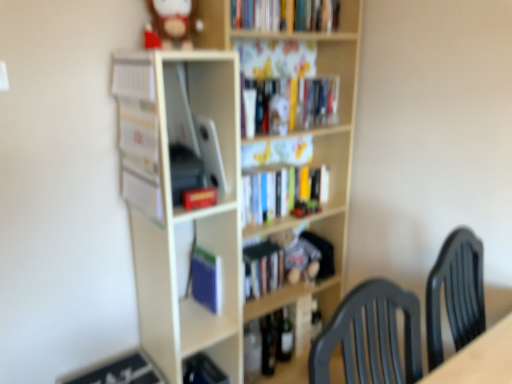
Question: From the image's perspective, does white paper at left, the third book from the top, appear lower than white matte bookshelf at center, marked as the second shelf in a right-to-left arrangement?

Choices:
 (A) yes
 (B) no

Answer: (B)

Question: Is white paper at left, the third book from the top, smaller than white matte bookshelf at center, marked as the second shelf in a right-to-left arrangement?

Choices:
 (A) no
 (B) yes

Answer: (B)

Question: Is white paper at left, the third book from the top, at the left side of white matte bookshelf at center, marked as the second shelf in a right-to-left arrangement?

Choices:
 (A) yes
 (B) no

Answer: (A)

Question: Is white paper at left, which appears as the fourth book when ordered from the bottom, thinner than white matte bookshelf at center, the first shelf when ordered from left to right?

Choices:
 (A) yes
 (B) no

Answer: (A)

Question: Is white paper at left, which appears as the fourth book when ordered from the bottom, in contact with white matte bookshelf at center, marked as the second shelf in a right-to-left arrangement?

Choices:
 (A) yes
 (B) no

Answer: (B)

Question: Is point pos(335,137) positioned closer to the camera than point pos(250,279)?

Choices:
 (A) farther
 (B) closer

Answer: (A)

Question: Choose the correct answer: Is wooden bookshelf at center, which is the 2th shelf from left to right, inside hardcover book at center, the second book ordered from the bottom, or outside it?

Choices:
 (A) outside
 (B) inside

Answer: (A)

Question: From their relative heights in the image, would you say wooden bookshelf at center, which is the 2th shelf from left to right, is taller or shorter than hardcover book at center, the second book ordered from the bottom?

Choices:
 (A) tall
 (B) short

Answer: (A)

Question: From the image's perspective, is wooden bookshelf at center, which is the 2th shelf from left to right, positioned above or below hardcover book at center, the second book ordered from the bottom?

Choices:
 (A) below
 (B) above

Answer: (B)

Question: Considering the positions of blue matte paperback book at center and hardcover book at center, the fifth book positioned from the top, in the image, is blue matte paperback book at center taller or shorter than hardcover book at center, the fifth book positioned from the top,?

Choices:
 (A) tall
 (B) short

Answer: (A)

Question: Considering the positions of point (197, 256) and point (261, 278), is point (197, 256) closer or farther from the camera than point (261, 278)?

Choices:
 (A) closer
 (B) farther

Answer: (A)

Question: Considering their positions, is blue matte paperback book at center located in front of or behind hardcover book at center, the second book ordered from the bottom?

Choices:
 (A) front
 (B) behind

Answer: (A)

Question: From a real-world perspective, is blue matte paperback book at center positioned above or below hardcover book at center, the second book ordered from the bottom?

Choices:
 (A) below
 (B) above

Answer: (B)

Question: In terms of size, does white paper at left, which appears as the fourth book when ordered from the bottom, appear bigger or smaller than matte black book at lower left, placed as the 6th book when sorted from top to bottom?

Choices:
 (A) small
 (B) big

Answer: (B)

Question: From the image's perspective, is white paper at left, the third book from the top, positioned above or below matte black book at lower left, placed as the first book when sorted from bottom to top?

Choices:
 (A) below
 (B) above

Answer: (B)